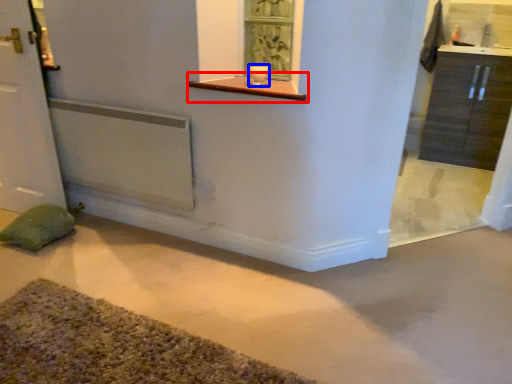
Question: Which of the following is the farthest to the observer, window sill (highlighted by a red box) or candle holder (highlighted by a blue box)?

Choices:
 (A) window sill
 (B) candle holder

Answer: (B)